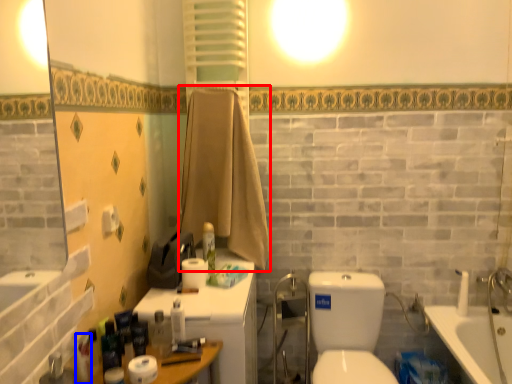
Question: Which object appears closest to the camera in this image, bath towel (highlighted by a red box) or toiletry (highlighted by a blue box)?

Choices:
 (A) bath towel
 (B) toiletry

Answer: (B)